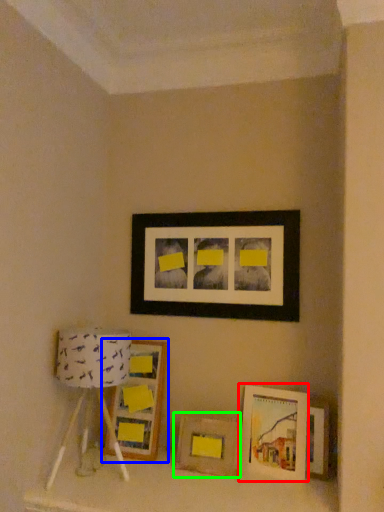
Question: Based on their relative distances, which object is farther from picture frame (highlighted by a red box)? Choose from picture frame (highlighted by a blue box) and picture frame (highlighted by a green box).

Choices:
 (A) picture frame
 (B) picture frame

Answer: (A)